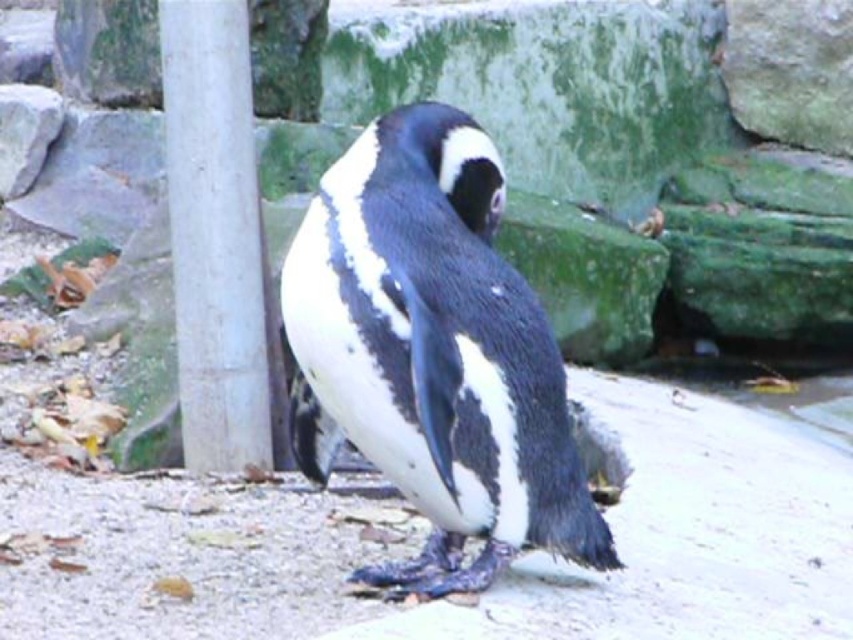
Is black-feathered penguin at center taller than white smooth pole at left?

No.

Is black-feathered penguin at center to the right of white smooth pole at left from the viewer's perspective?

Yes, black-feathered penguin at center is to the right of white smooth pole at left.

Is point (532, 344) less distant than point (225, 282)?

Yes, point (532, 344) is in front of point (225, 282).

Find the location of a particular element. This screenshot has height=640, width=853. black-feathered penguin at center is located at coordinates coord(433,353).